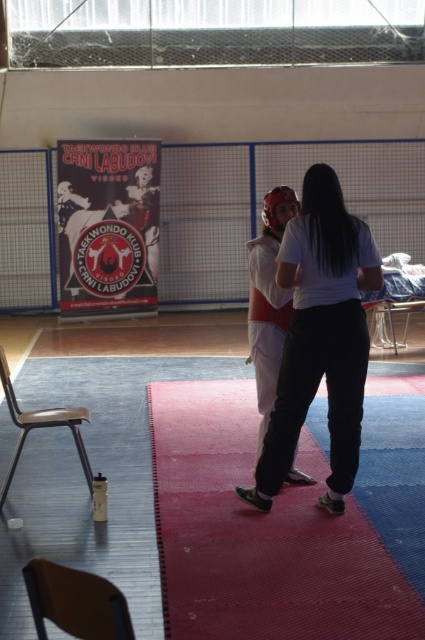
Question: Where is white cotton t-shirt at center located in relation to white matte/soft t-shirt at center in the image?

Choices:
 (A) below
 (B) above

Answer: (A)

Question: Does rubberized red mat at center have a smaller size compared to white matte/soft t-shirt at center?

Choices:
 (A) no
 (B) yes

Answer: (A)

Question: Among these objects, which one is nearest to the camera?

Choices:
 (A) white matte/soft t-shirt at center
 (B) white cotton t-shirt at center
 (C) rubberized red mat at center

Answer: (C)

Question: Which point is closer to the camera?

Choices:
 (A) (248, 307)
 (B) (297, 512)
 (C) (306, 310)

Answer: (C)

Question: Which of these objects is positioned closest to the white cotton t-shirt at center?

Choices:
 (A) rubberized red mat at center
 (B) white matte/soft t-shirt at center

Answer: (B)

Question: Does rubberized red mat at center have a greater width compared to white matte/soft t-shirt at center?

Choices:
 (A) no
 (B) yes

Answer: (B)